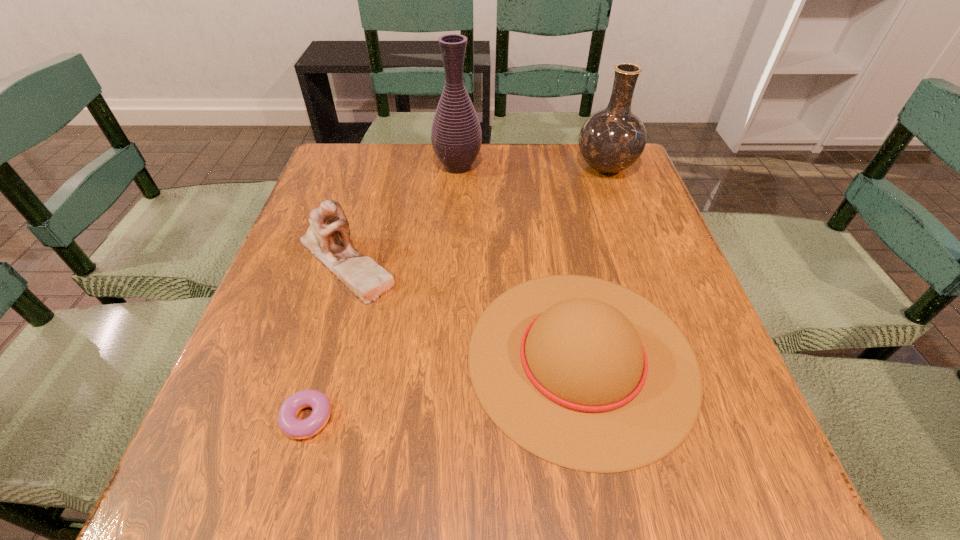
Where is `the left vase`? the left vase is located at coordinates (456, 136).

Where is `the taller vase`? The image size is (960, 540). the taller vase is located at coordinates (456, 136).

The image size is (960, 540). What are the coordinates of `the right vase` in the screenshot? It's located at (611, 140).

The height and width of the screenshot is (540, 960). Identify the location of the shorter vase. (611, 140).

Where is `figurine`? figurine is located at coordinates (327, 238).

You are a GUI agent. You are given a task and a screenshot of the screen. Output one action in this format:
    pyautogui.click(x=<x>, y=<y>)
    Task: Click on the sombrero
    The image size is (960, 540).
    Given the screenshot: What is the action you would take?
    pyautogui.click(x=584, y=373)

Find the location of a particular element. Image resolution: width=960 pixels, height=540 pixels. the shortest object is located at coordinates (291, 426).

Locate an element on the screen. The width and height of the screenshot is (960, 540). vacant area situated on the front of the tallest object is located at coordinates (452, 252).

Find the location of a particular element. vacant space located 0.390m on the front of the shorter vase is located at coordinates (653, 299).

Where is `blank area located on the front-facing side of the figurine`? This screenshot has height=540, width=960. blank area located on the front-facing side of the figurine is located at coordinates (320, 347).